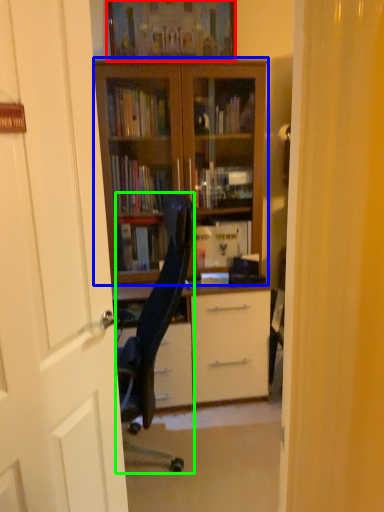
Question: Estimate the real-world distances between objects in this image. Which object is farther from picture frame (highlighted by a red box), bookcase (highlighted by a blue box) or chair (highlighted by a green box)?

Choices:
 (A) bookcase
 (B) chair

Answer: (B)